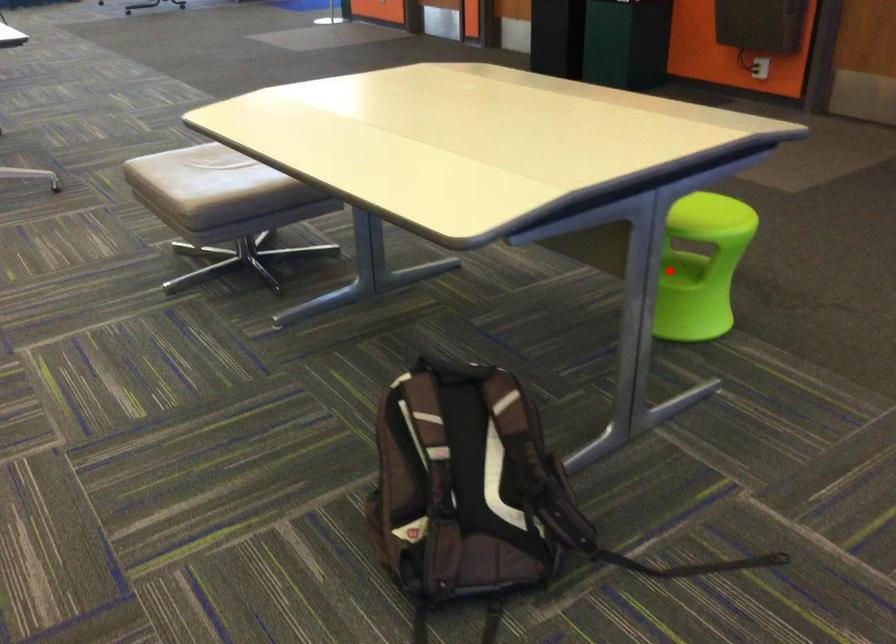
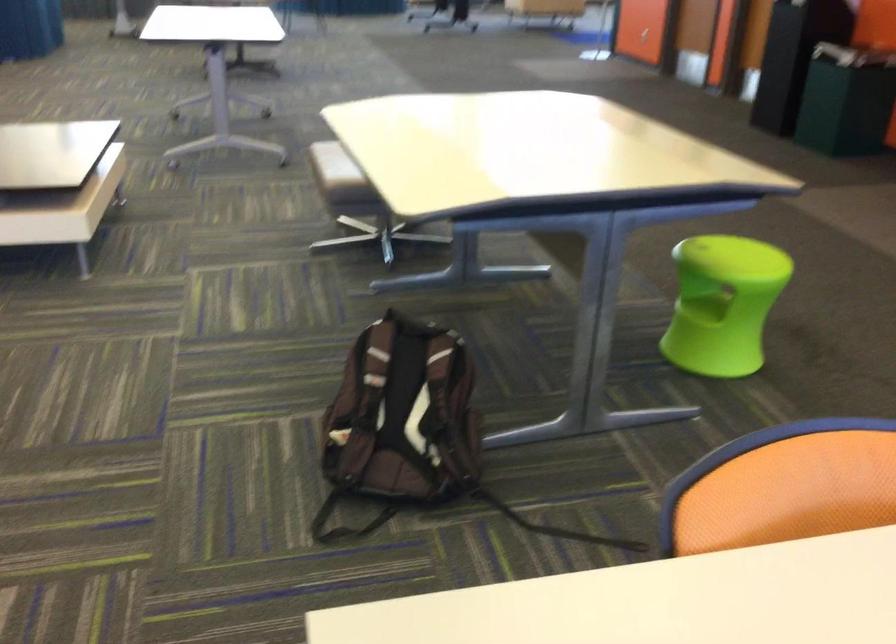
Find the pixel in the second image that matches the highlighted location in the first image.

(702, 307)